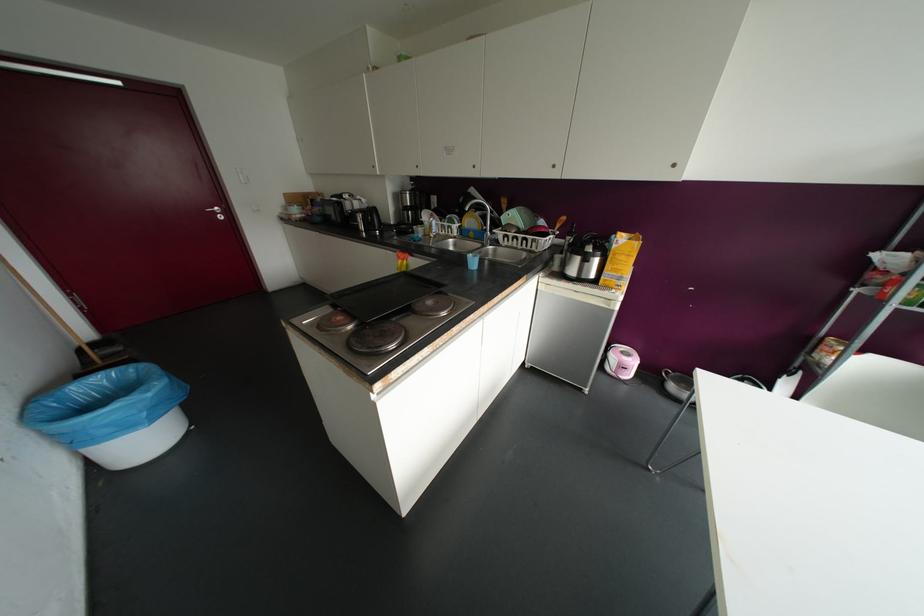
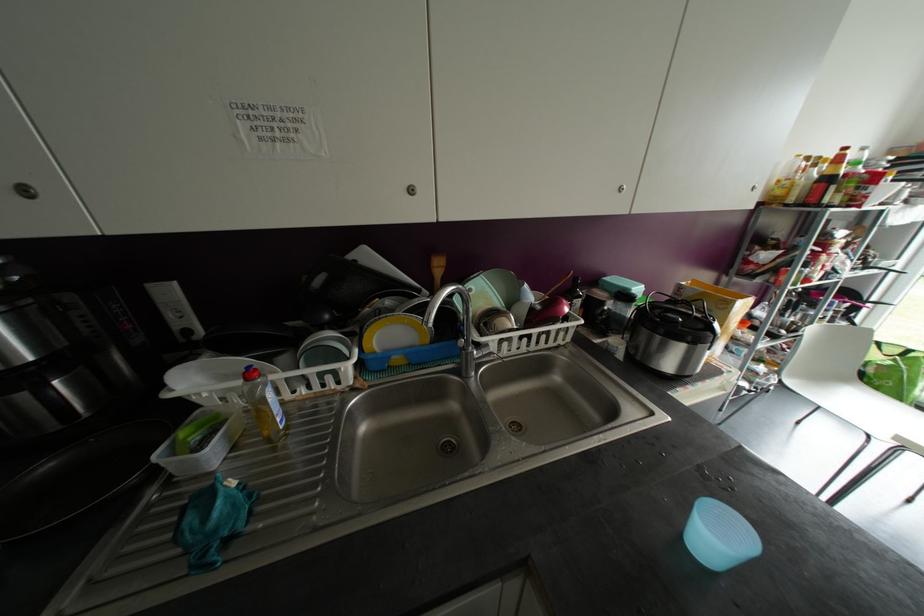
Question: I am providing you with two images of the same scene from different viewpoints. After the viewpoint changes to image2, which objects are now occluded?

Choices:
 (A) yellow dish soap bottle
 (B) red bowl
 (C) round cabinet handle
 (D) none of these

Answer: (D)